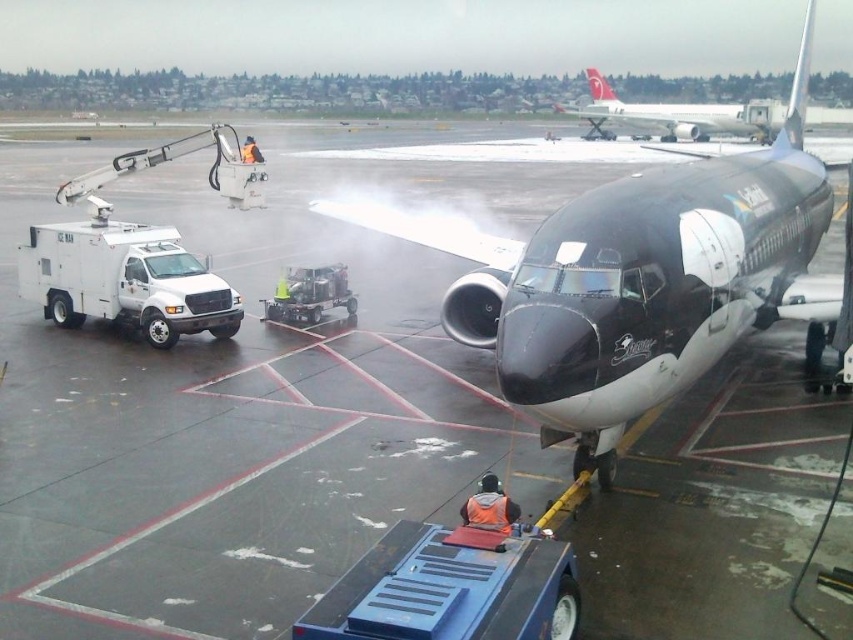
You are a maintenance worker standing at the entrance of the airport terminal. You need to locate the shiny black airplane at center for an inspection. Based on the coordinates provided in the scene description, in which general direction should you head from your current position to reach it?

The shiny black airplane at center is located at coordinates point (639, 282). Since the airplane is at the center of the scene, you should head straight ahead from the terminal entrance towards the middle of the tarmac to reach it.

Looking at the airport scene, where is the shiny black airplane at center in relation to the white glossy airplane at upper center?

The shiny black airplane at center is positioned to the left of the white glossy airplane at upper center.